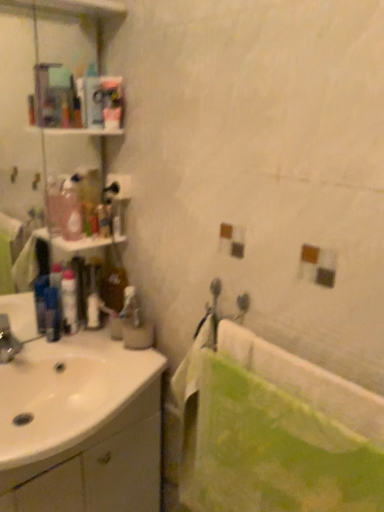
This screenshot has height=512, width=384. What do you see at coordinates (81, 246) in the screenshot?
I see `translucent plastic bottles at left` at bounding box center [81, 246].

In the scene shown: What is the approximate height of translucent plastic bottles at left?

translucent plastic bottles at left is 0.72 inches in height.

Measure the distance between translucent plastic soap dispenser at left, which is counted as the 1th toiletry, starting from the top, and camera.

translucent plastic soap dispenser at left, which is counted as the 1th toiletry, starting from the top, is 1.44 meters away from camera.

The width and height of the screenshot is (384, 512). Describe the element at coordinates (305, 380) in the screenshot. I see `green fabric bath at right` at that location.

You are a GUI agent. You are given a task and a screenshot of the screen. Output one action in this format:
    pyautogui.click(x=<x>, y=<y>)
    Task: Click on the metallic silver faucet at left
    This screenshot has height=512, width=384.
    Given the screenshot: What is the action you would take?
    pyautogui.click(x=8, y=341)

Which object is thinner, translucent plastic bottle at left or metallic silver faucet at left?

Thinner between the two is translucent plastic bottle at left.

Can you tell me how much translucent plastic bottle at left and metallic silver faucet at left differ in facing direction?

8.68 degrees.

Can metallic silver faucet at left be found inside translucent plastic bottle at left?

No, metallic silver faucet at left is not surrounded by translucent plastic bottle at left.

Is translucent plastic bottle at left taller than metallic silver faucet at left?

Yes.

Is translucent plastic bottles at left positioned far away from metallic silver faucet at left?

translucent plastic bottles at left is actually quite close to metallic silver faucet at left.

From their relative heights in the image, would you say translucent plastic bottles at left is taller or shorter than metallic silver faucet at left?

Considering their sizes, translucent plastic bottles at left has less height than metallic silver faucet at left.

From a real-world perspective, who is located higher, translucent plastic bottles at left or metallic silver faucet at left?

In real-world perspective, translucent plastic bottles at left is above.

Does green fabric bath at right have a greater height compared to translucent plastic bottle at left?

No.

Is green fabric bath at right turned away from translucent plastic bottle at left?

No, translucent plastic bottle at left is not at the back of green fabric bath at right.

Between green fabric bath at right and translucent plastic bottle at left, which one has larger width?

Wider between the two is green fabric bath at right.

Is green fabric bath at right not near translucent plastic bottle at left?

No, green fabric bath at right is in close proximity to translucent plastic bottle at left.

Based on the photo, is translucent plastic bottle at left not near white glossy sink at left?

No, translucent plastic bottle at left is in close proximity to white glossy sink at left.

Where is `sink that appears in front of the translucent plastic bottle at left`? Image resolution: width=384 pixels, height=512 pixels. sink that appears in front of the translucent plastic bottle at left is located at coordinates (81, 426).

From the picture: Based on their positions, is translucent plastic bottle at left located to the left or right of white glossy sink at left?

In the image, translucent plastic bottle at left appears on the right side of white glossy sink at left.

Can you confirm if translucent plastic bottle at left is taller than white glossy sink at left?

Yes, translucent plastic bottle at left is taller than white glossy sink at left.

Considering their positions, is green fabric bath at right located in front of or behind blue plastic mouthwash at left?

Clearly, green fabric bath at right is in front of blue plastic mouthwash at left.

Does point (248, 361) come behind point (52, 330)?

No, (248, 361) is closer to viewer.

Are green fabric bath at right and blue plastic mouthwash at left making contact?

No, green fabric bath at right is not in contact with blue plastic mouthwash at left.

How many degrees apart are the facing directions of green fabric bath at right and blue plastic mouthwash at left?

51 degrees.

Is white glossy lotion at left, acting as the 2th toiletry starting from the right, taller than white glossy sink at left?

Yes.

Is white glossy lotion at left, which is counted as the 1th toiletry, starting from the bottom, in front of or behind white glossy sink at left in the image?

Clearly, white glossy lotion at left, which is counted as the 1th toiletry, starting from the bottom, is behind white glossy sink at left.

In the image, is white glossy lotion at left, positioned as the 1th toiletry in left-to-right order, on the left side or the right side of white glossy sink at left?

Based on their positions, white glossy lotion at left, positioned as the 1th toiletry in left-to-right order, is located to the left of white glossy sink at left.

The height and width of the screenshot is (512, 384). I want to click on the 1st toiletry above the white glossy sink at left (from the image's perspective), so click(69, 302).

From the image's perspective, which one is positioned higher, white glossy lotion at left, the 2th toiletry when ordered from top to bottom, or green fabric towel at lower right?

white glossy lotion at left, the 2th toiletry when ordered from top to bottom, from the image's perspective.

Is white glossy lotion at left, which is counted as the 1th toiletry, starting from the bottom, not within green fabric towel at lower right?

That's correct, white glossy lotion at left, which is counted as the 1th toiletry, starting from the bottom, is outside of green fabric towel at lower right.

Would you say white glossy lotion at left, which is counted as the 1th toiletry, starting from the bottom, is to the left or to the right of green fabric towel at lower right in the picture?

white glossy lotion at left, which is counted as the 1th toiletry, starting from the bottom, is positioned on green fabric towel at lower right's left side.

There is a green fabric towel at lower right. Where is `the 1st toiletry above it (from the image's perspective)`? This screenshot has width=384, height=512. the 1st toiletry above it (from the image's perspective) is located at coordinates (69, 302).

Image resolution: width=384 pixels, height=512 pixels. I want to click on cleaning product that appears on the right of metallic silver faucet at left, so click(70, 209).

Locate an element on the screen. The image size is (384, 512). tap on the left of the translucent plastic bottles at left is located at coordinates (8, 341).

Consider the image. When comparing their distances from metallic silver faucet at left, does white glossy sink at left or translucent plastic soap dispenser at left, which ranks as the second toiletry in left-to-right order, seem closer?

white glossy sink at left is positioned closer to the anchor metallic silver faucet at left.

In the scene shown: Which object lies nearer to the anchor point white glossy lotion at left, which is counted as the 1th toiletry, starting from the bottom, white glossy sink at left or green fabric bath at right?

The object closer to white glossy lotion at left, which is counted as the 1th toiletry, starting from the bottom, is white glossy sink at left.

Based on their spatial positions, is metallic silver faucet at left or blue plastic mouthwash at left further from translucent plastic bottle at left?

metallic silver faucet at left is positioned further to the anchor translucent plastic bottle at left.

Estimate the real-world distances between objects in this image. Which object is further from metallic silver faucet at left, translucent plastic bottle at left or green fabric towel at lower right?

green fabric towel at lower right is further to metallic silver faucet at left.

Looking at the image, which one is located closer to translucent plastic bottle at left, translucent plastic bottles at left or metallic silver faucet at left?

Among the two, translucent plastic bottles at left is located nearer to translucent plastic bottle at left.

Which object lies further to the anchor point white glossy sink at left, green fabric bath at right or translucent plastic soap dispenser at left, which is counted as the 1th toiletry, starting from the top?

translucent plastic soap dispenser at left, which is counted as the 1th toiletry, starting from the top, is further to white glossy sink at left.

Which object lies nearer to the anchor point blue plastic mouthwash at left, translucent plastic bottles at left or green fabric bath at right?

Among the two, translucent plastic bottles at left is located nearer to blue plastic mouthwash at left.

Estimate the real-world distances between objects in this image. Which object is closer to metallic silver faucet at left, translucent plastic soap dispenser at left, which ranks as the second toiletry in left-to-right order, or translucent plastic bottles at left?

A: translucent plastic bottles at left is positioned closer to the anchor metallic silver faucet at left.

The height and width of the screenshot is (512, 384). Identify the location of cleaning product located between metallic silver faucet at left and green fabric bath at right in the left-right direction. (70, 209).

Identify the location of bath towel between white glossy sink at left and green fabric bath at right. (270, 450).

Where is `cleaning product between green fabric bath at right and white glossy lotion at left, positioned as the 1th toiletry in left-to-right order, from front to back`? The height and width of the screenshot is (512, 384). cleaning product between green fabric bath at right and white glossy lotion at left, positioned as the 1th toiletry in left-to-right order, from front to back is located at coordinates (70, 209).

Where is `shelf between translucent plastic bottle at left and white glossy lotion at left, acting as the 2th toiletry starting from the right, in the vertical direction`? shelf between translucent plastic bottle at left and white glossy lotion at left, acting as the 2th toiletry starting from the right, in the vertical direction is located at coordinates (81, 246).